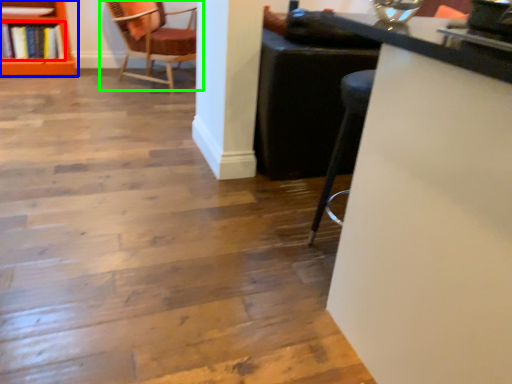
Question: Based on their relative distances, which object is nearer to book (highlighted by a red box)? Choose from shelf (highlighted by a blue box) and chair (highlighted by a green box).

Choices:
 (A) shelf
 (B) chair

Answer: (A)